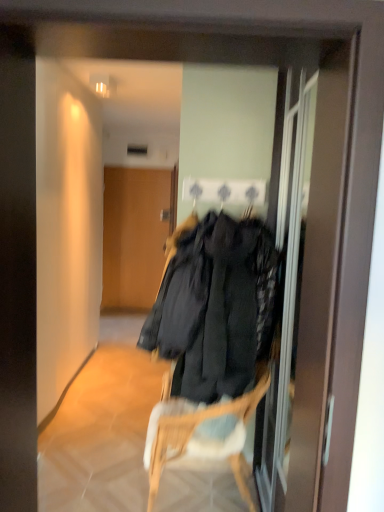
Question: Is woven wood chair at center facing away from wooden door at center?

Choices:
 (A) no
 (B) yes

Answer: (B)

Question: Are woven wood chair at center and wooden door at center located far from each other?

Choices:
 (A) yes
 (B) no

Answer: (A)

Question: From a real-world perspective, is woven wood chair at center over wooden door at center?

Choices:
 (A) yes
 (B) no

Answer: (B)

Question: Does woven wood chair at center have a larger size compared to wooden door at center?

Choices:
 (A) no
 (B) yes

Answer: (B)

Question: Does woven wood chair at center turn towards wooden door at center?

Choices:
 (A) yes
 (B) no

Answer: (B)

Question: Is the position of woven wood chair at center more distant than that of wooden door at center?

Choices:
 (A) no
 (B) yes

Answer: (A)

Question: Can we say transparent glass screen door at center lies outside woven wood chair at center?

Choices:
 (A) no
 (B) yes

Answer: (B)

Question: Can you confirm if transparent glass screen door at center is shorter than woven wood chair at center?

Choices:
 (A) no
 (B) yes

Answer: (A)

Question: Does transparent glass screen door at center come behind woven wood chair at center?

Choices:
 (A) no
 (B) yes

Answer: (A)

Question: Is transparent glass screen door at center to the right of woven wood chair at center from the viewer's perspective?

Choices:
 (A) no
 (B) yes

Answer: (B)

Question: Is transparent glass screen door at center facing away from woven wood chair at center?

Choices:
 (A) no
 (B) yes

Answer: (B)

Question: From the image's perspective, is transparent glass screen door at center beneath woven wood chair at center?

Choices:
 (A) no
 (B) yes

Answer: (A)

Question: From the image's perspective, is wooden door at center over transparent glass screen door at center?

Choices:
 (A) yes
 (B) no

Answer: (A)